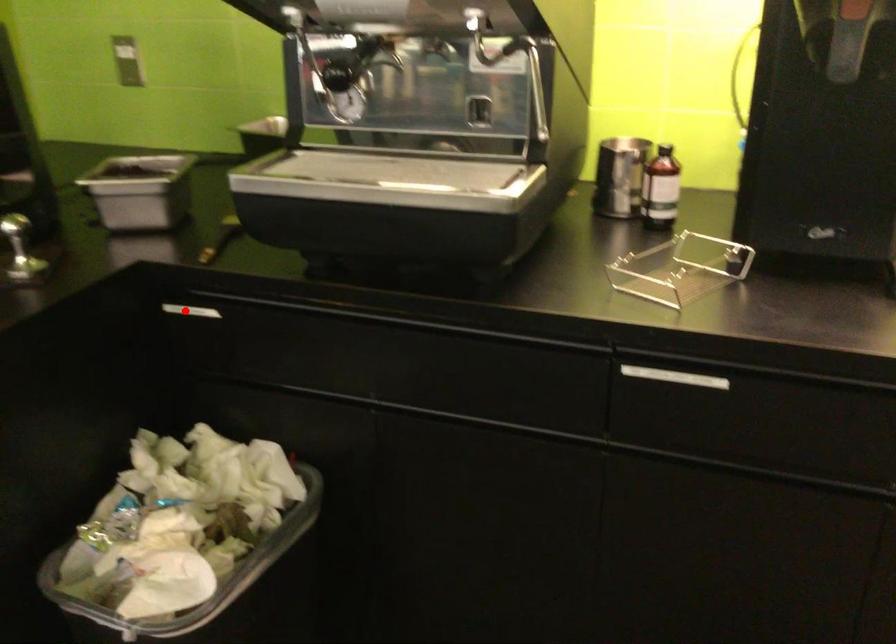
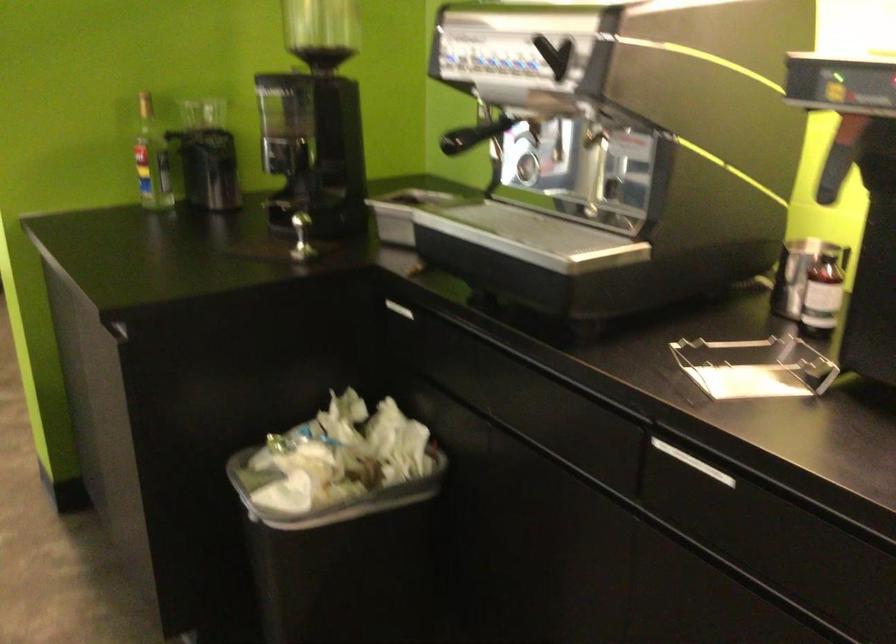
Question: I am providing you with two images of the same scene from different viewpoints. Image1 has a red point marked. In image2, the corresponding 3D location appears at what relative position? Reply with the corresponding letter.

Choices:
 (A) Closer
 (B) Farther

Answer: (B)